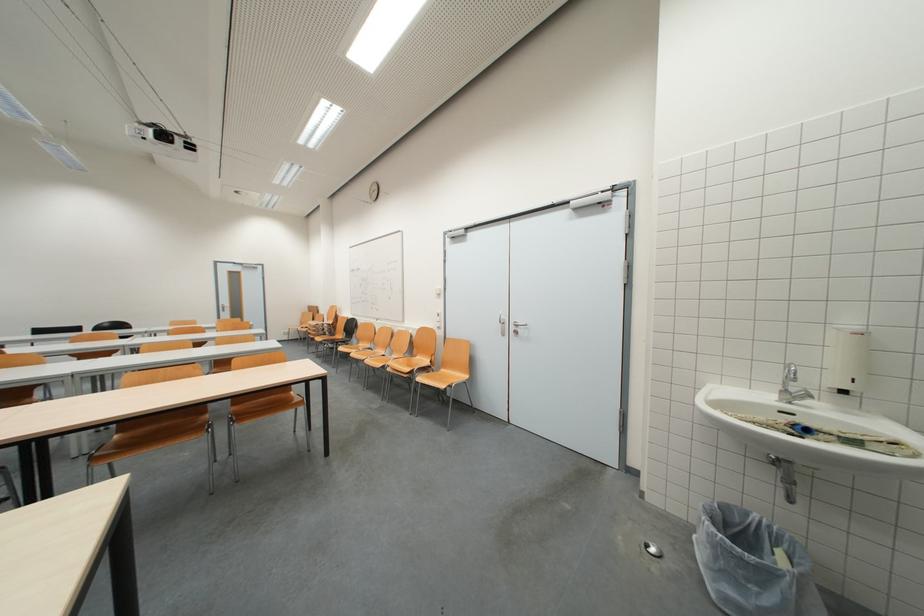
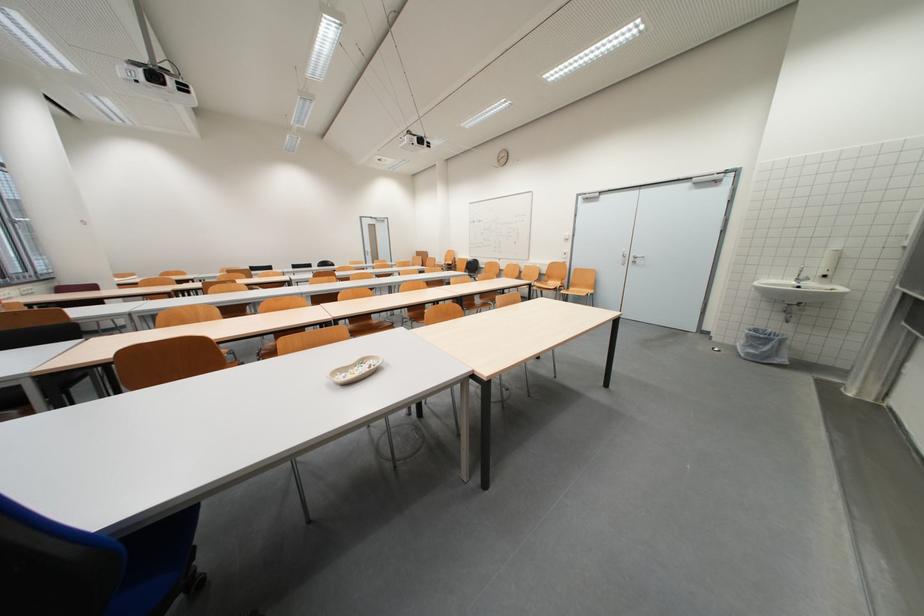
Where in the second image is the point corresponding to [331,384] from the first image?

(537, 291)